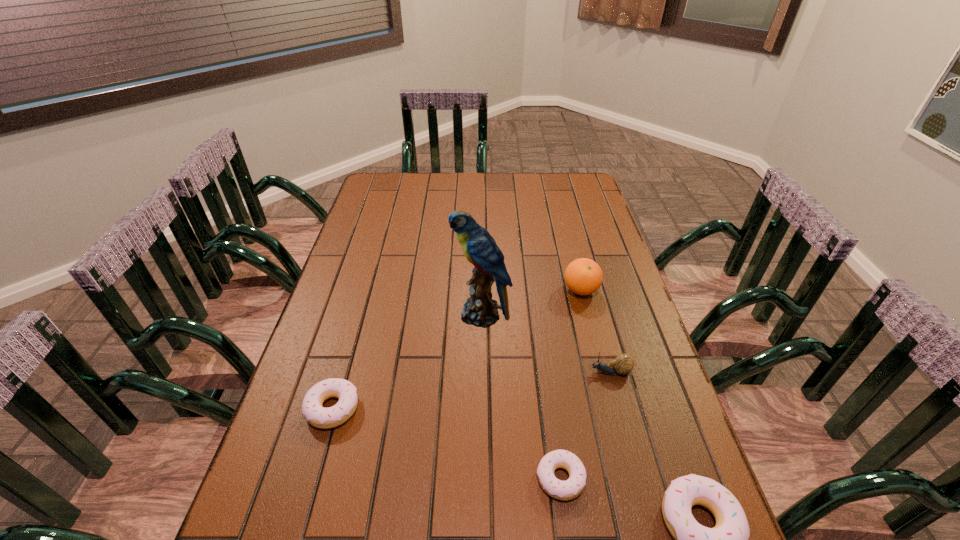
Locate an element on the screen. Image resolution: width=960 pixels, height=540 pixels. free space between the third farthest object and the orange is located at coordinates (595, 331).

Locate an element on the screen. The image size is (960, 540). free space between the second tallest object and the second doughnut from right to left is located at coordinates (570, 384).

At what (x,y) coordinates should I click in order to perform the action: click on free spot between the tallest object and the escargot. Please return your answer as a coordinate pair (x, y). Looking at the image, I should click on (545, 343).

This screenshot has height=540, width=960. Identify the location of vacant space in between the second tallest object and the tallest object. tap(531, 302).

Select which object is the closest to the second doughnut from right to left. Please provide its 2D coordinates. Your answer should be formatted as a tuple, i.e. [(x, y)], where the tuple contains the x and y coordinates of a point satisfying the conditions above.

[(728, 539)]

Point out which object is positioned as the nearest to the second tallest object. Please provide its 2D coordinates. Your answer should be formatted as a tuple, i.e. [(x, y)], where the tuple contains the x and y coordinates of a point satisfying the conditions above.

[(479, 247)]

The height and width of the screenshot is (540, 960). Identify the location of the closest doughnut relative to the orange. (566, 490).

Identify which doughnut is located as the second nearest to the third nearest object. Please provide its 2D coordinates. Your answer should be formatted as a tuple, i.e. [(x, y)], where the tuple contains the x and y coordinates of a point satisfying the conditions above.

[(728, 539)]

Image resolution: width=960 pixels, height=540 pixels. I want to click on free space that satisfies the following two spatial constraints: 1. on the face of the second object from left to right; 2. on the front side of the leftmost object, so pos(482,408).

Where is `free region that satisfies the following two spatial constraints: 1. on the face of the parrot; 2. on the front side of the second shortest doughnut`? The height and width of the screenshot is (540, 960). free region that satisfies the following two spatial constraints: 1. on the face of the parrot; 2. on the front side of the second shortest doughnut is located at coordinates (482, 408).